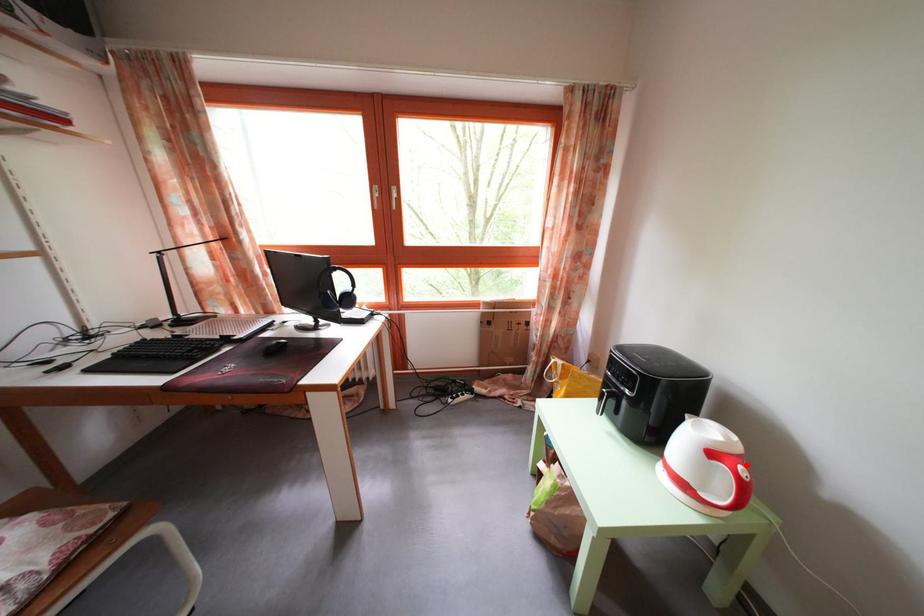
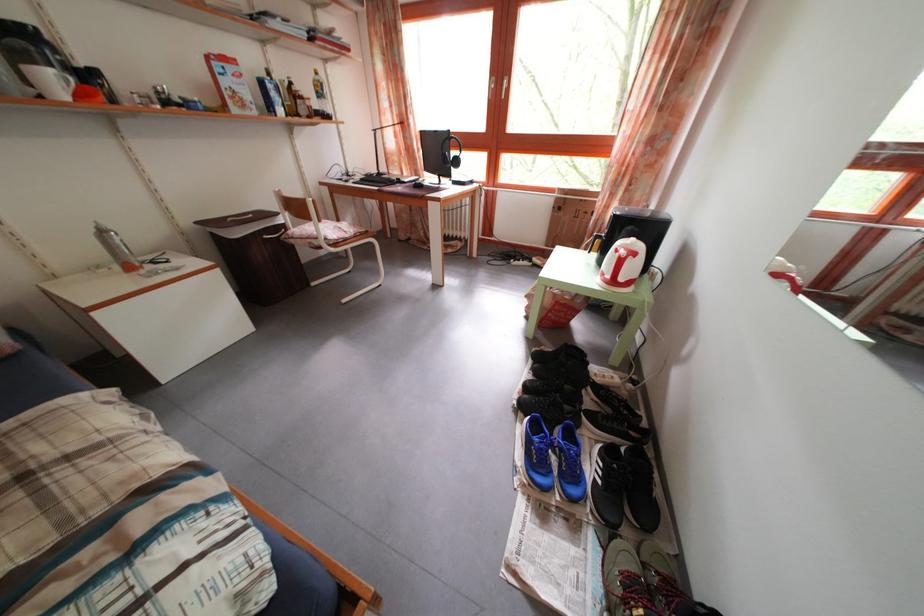
Find the pixel in the second image that matches the highlighted location in the first image.

(641, 262)